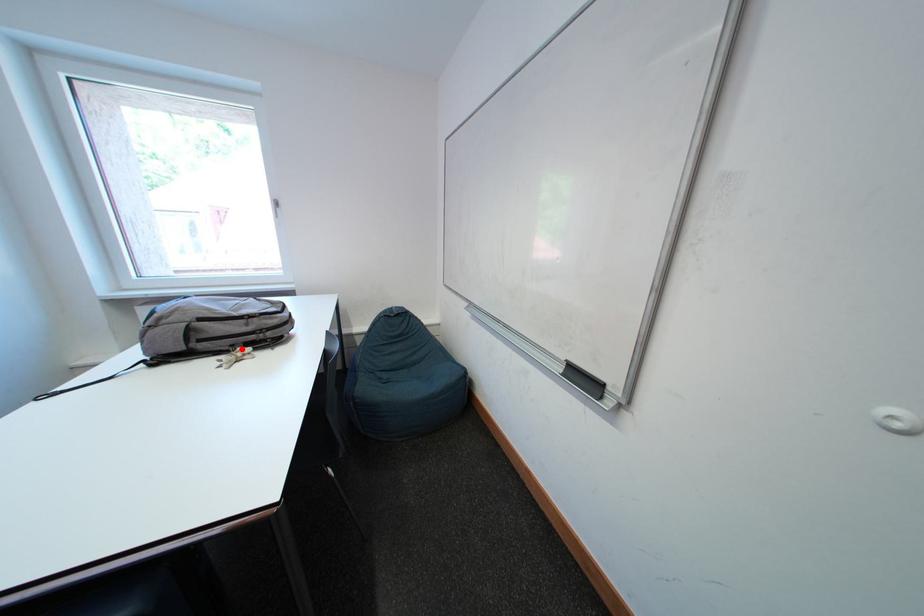
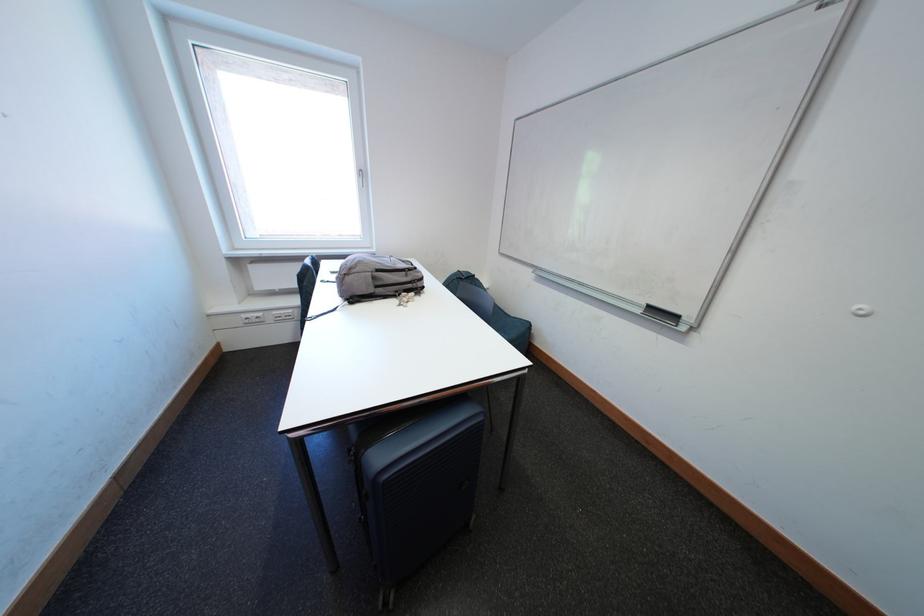
Where in the second image is the point corresponding to the highlighted location from the first image?

(406, 294)